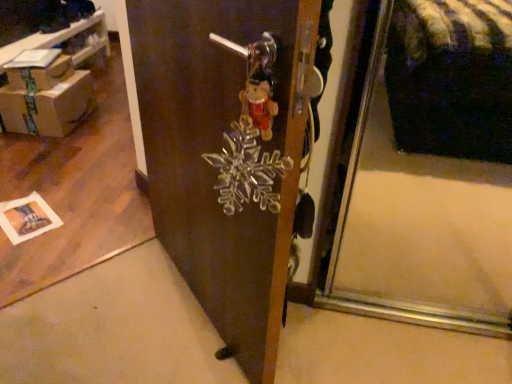
Question: Is brown cardboard boxes at left looking in the opposite direction of cardboard box at left?

Choices:
 (A) no
 (B) yes

Answer: (A)

Question: From the image's perspective, would you say brown cardboard boxes at left is positioned over cardboard box at left?

Choices:
 (A) yes
 (B) no

Answer: (A)

Question: From a real-world perspective, is brown cardboard boxes at left below cardboard box at left?

Choices:
 (A) no
 (B) yes

Answer: (A)

Question: Considering the relative sizes of brown cardboard boxes at left and cardboard box at left in the image provided, is brown cardboard boxes at left thinner than cardboard box at left?

Choices:
 (A) no
 (B) yes

Answer: (A)

Question: Are brown cardboard boxes at left and cardboard box at left located far from each other?

Choices:
 (A) no
 (B) yes

Answer: (A)

Question: Is cardboard box at left taller or shorter than brown cardboard box at upper left?

Choices:
 (A) tall
 (B) short

Answer: (A)

Question: Relative to brown cardboard box at upper left, is cardboard box at left in front or behind?

Choices:
 (A) front
 (B) behind

Answer: (A)

Question: Looking at their shapes, would you say cardboard box at left is wider or thinner than brown cardboard box at upper left?

Choices:
 (A) thin
 (B) wide

Answer: (B)

Question: Is cardboard box at left situated inside brown cardboard box at upper left or outside?

Choices:
 (A) inside
 (B) outside

Answer: (B)

Question: Is cardboard box at left inside or outside of brown cardboard boxes at left?

Choices:
 (A) inside
 (B) outside

Answer: (B)

Question: Based on their sizes in the image, would you say cardboard box at left is bigger or smaller than brown cardboard boxes at left?

Choices:
 (A) big
 (B) small

Answer: (B)

Question: Considering their positions, is cardboard box at left located in front of or behind brown cardboard boxes at left?

Choices:
 (A) behind
 (B) front

Answer: (A)

Question: Is cardboard box at left to the left or to the right of brown cardboard boxes at left in the image?

Choices:
 (A) right
 (B) left

Answer: (A)

Question: Is cardboard box at left to the left or to the right of transparent glass snowflake at center in the image?

Choices:
 (A) right
 (B) left

Answer: (B)

Question: Is cardboard box at left wider or thinner than transparent glass snowflake at center?

Choices:
 (A) thin
 (B) wide

Answer: (B)